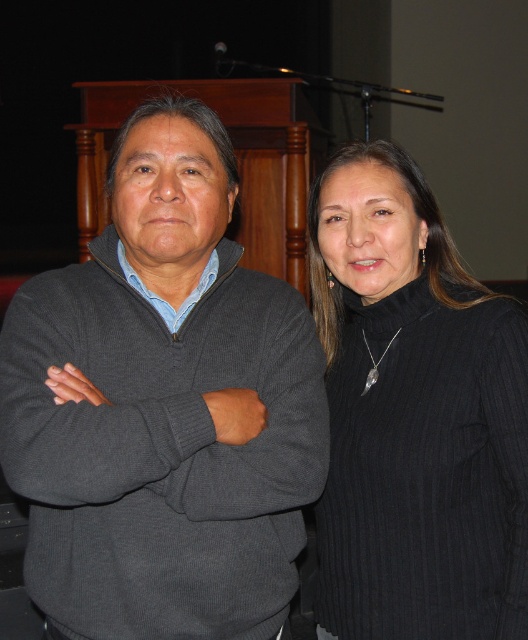
You are a photographer at a formal event. You need to capture a photo where both the dark gray sweater at center and the black ribbed sweater at right are clearly visible. Based on their positions, which sweater should you focus on first to ensure both are in focus?

You should focus on the dark gray sweater at center first because it is in front of the black ribbed sweater at right, so adjusting focus starting from the closer object ensures both are in focus.

You are standing at the front of the room and need to place a small decorative item between the two points, point (x=181, y=352) and point (x=456, y=412). Which point should the item be closer to in order to be positioned in front of both?

The item should be closer to point (x=181, y=352) because it is in front of point (x=456, y=412).